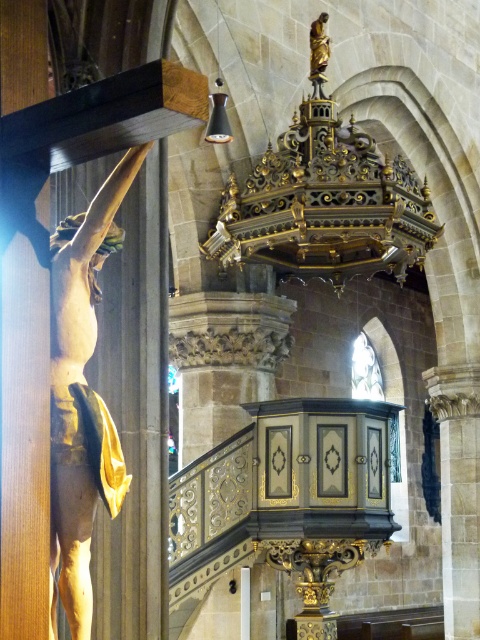
You are an interior designer assessing the placement of statues in a church. You notice the matte gold statue at left and the gold polished wood statue at upper center. Which statue is positioned lower in the scene?

The matte gold statue at left is positioned lower than the gold polished wood statue at upper center.

You are an interior designer assessing the statues in the church. Which statue, the matte gold statue at left or the gold polished wood statue at upper center, would you say is larger?

The matte gold statue at left is bigger than the gold polished wood statue at upper center.

You are an interior designer assessing the spatial arrangement of the church. You need to ensure that the matte gold statue at left and the gold polished wood statue at upper center do not block the view of the crucifix. Given their heights, which statue might be more likely to obstruct the view and why?

The matte gold statue at left is much taller than the gold polished wood statue at upper center, so it is more likely to obstruct the view of the crucifix.